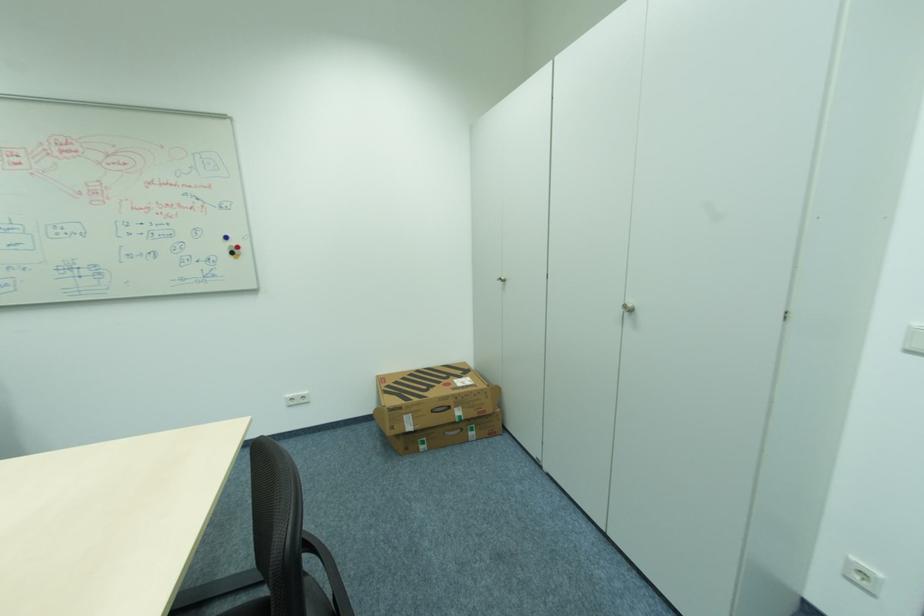
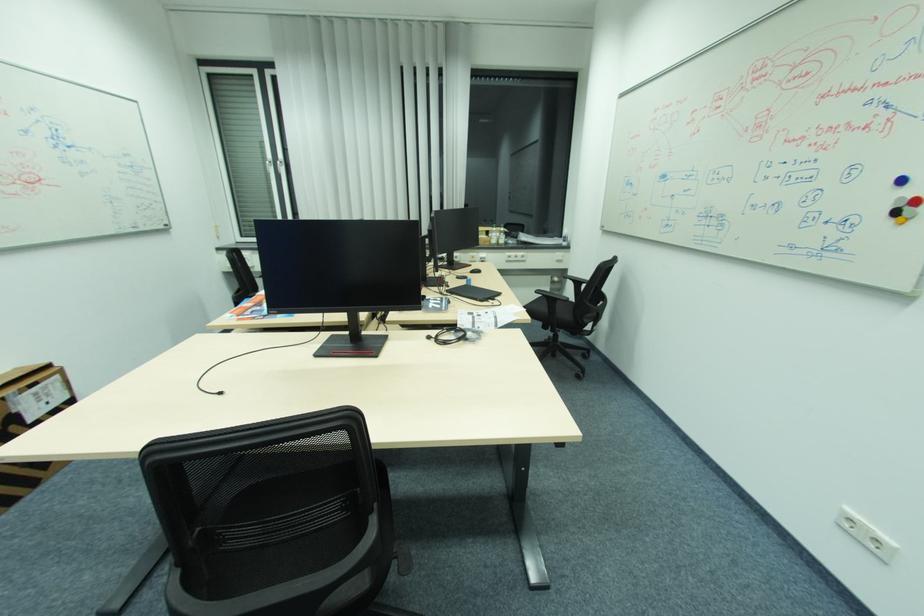
In the second image, find the point that corresponds to point (238, 249) in the first image.

(907, 206)